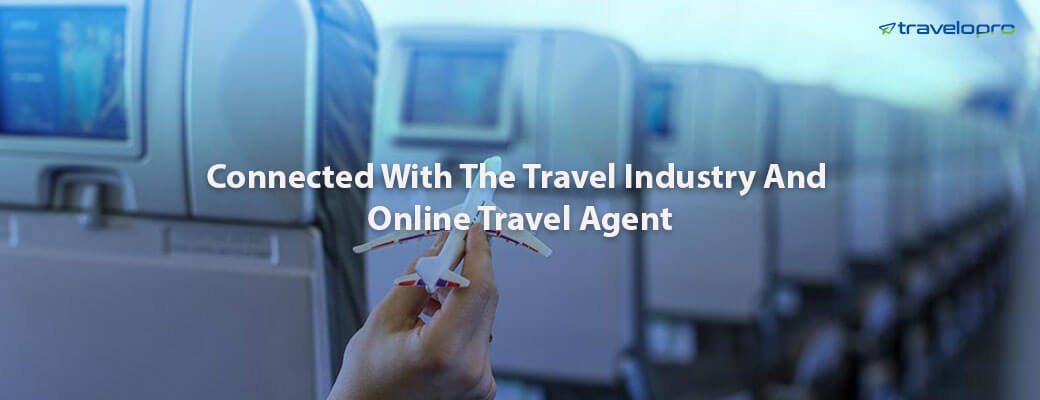
Identify the location of screen. (45, 48).